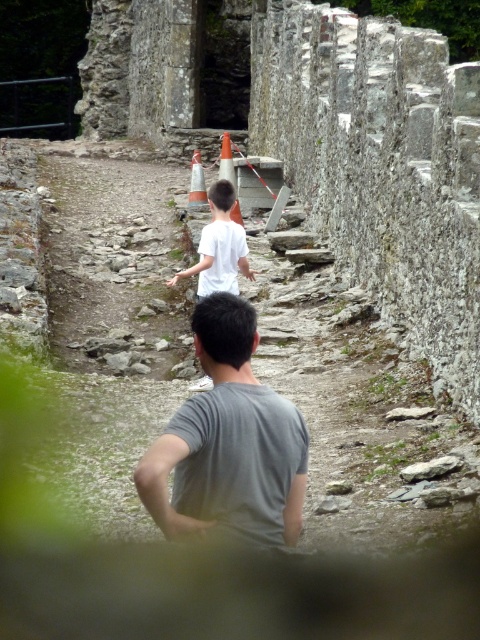
You are a tour guide leading a group on this historical pathway. You notice two visitors ahead wearing a gray matte shirt at center and a white matte shirt at center. Which visitor is shorter in height?

The gray matte shirt at center has a lesser height compared to the white matte shirt at center, so the visitor wearing the gray matte shirt at center is shorter.

You are standing at the point labeled point at (216, 228). You want to walk to the nearest person. Which direction should you go?

The nearest person is the one wearing a gray T shirt at lower center. You should walk towards the gray T shirt at lower center.